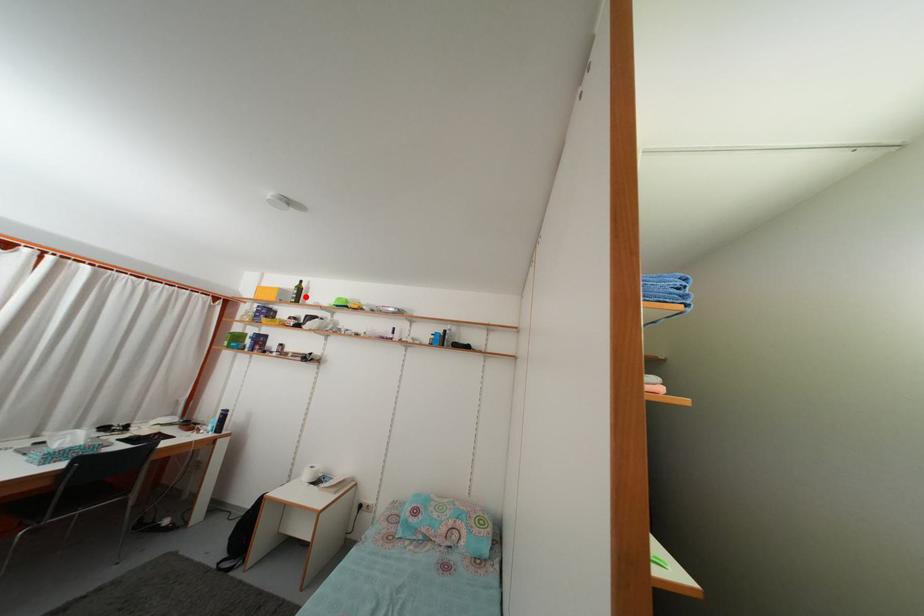
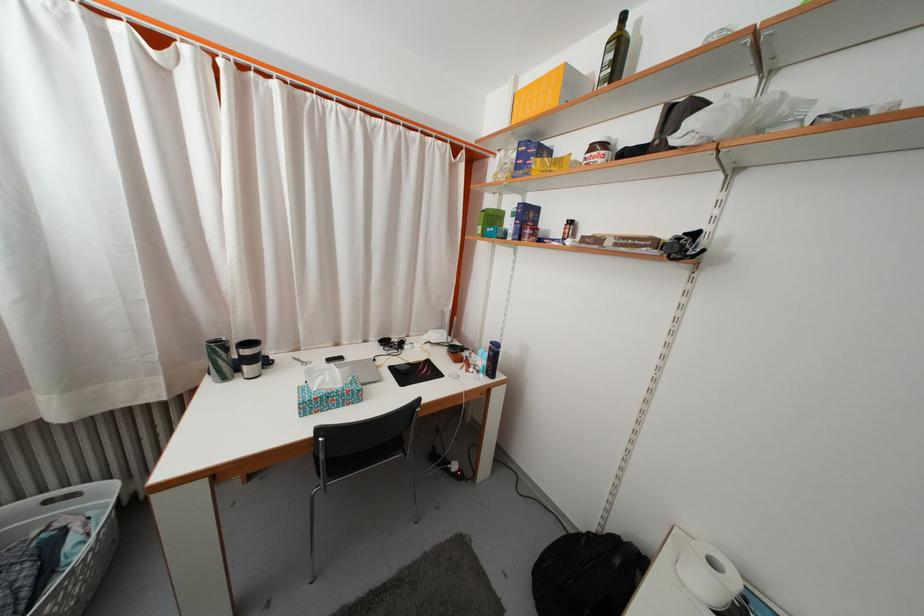
The point at the highlighted location is marked in the first image. Where is the corresponding point in the second image?

(625, 54)